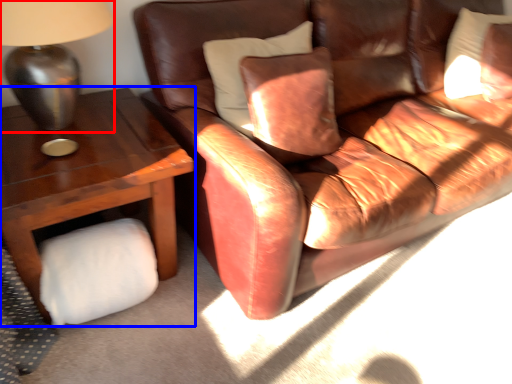
Question: Which point is closer to the camera, table lamp (highlighted by a red box) or table (highlighted by a blue box)?

Choices:
 (A) table lamp
 (B) table

Answer: (A)